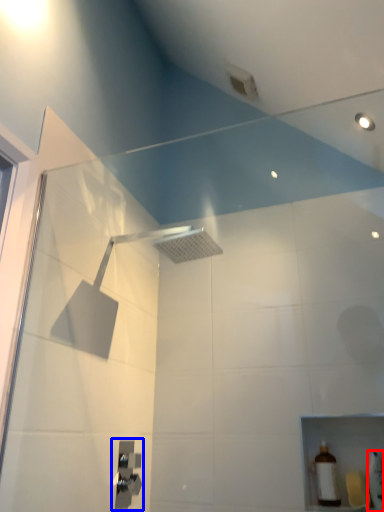
Question: Among these objects, which one is farthest to the camera, toiletry (highlighted by a red box) or shower (highlighted by a blue box)?

Choices:
 (A) toiletry
 (B) shower

Answer: (B)